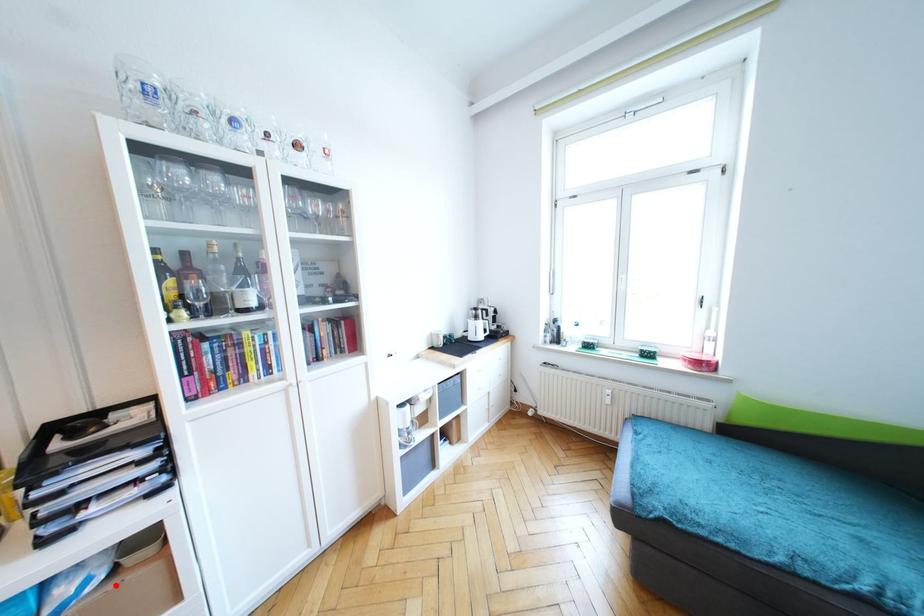
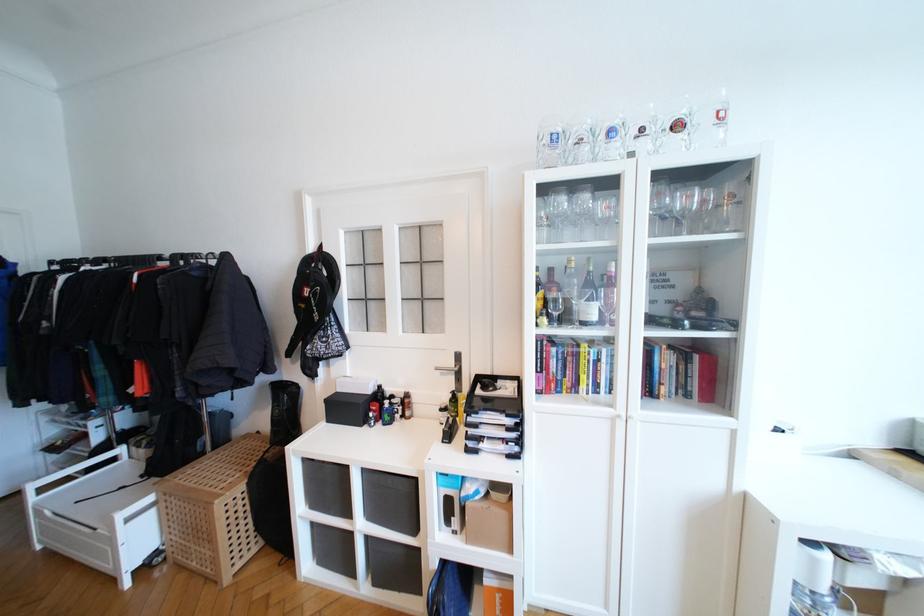
Question: I am providing you with two images of the same scene from different viewpoints. Image1 has a red point marked. In image2, the corresponding 3D location appears at what relative position? Reply with the corresponding letter.

Choices:
 (A) Closer
 (B) Farther

Answer: (B)